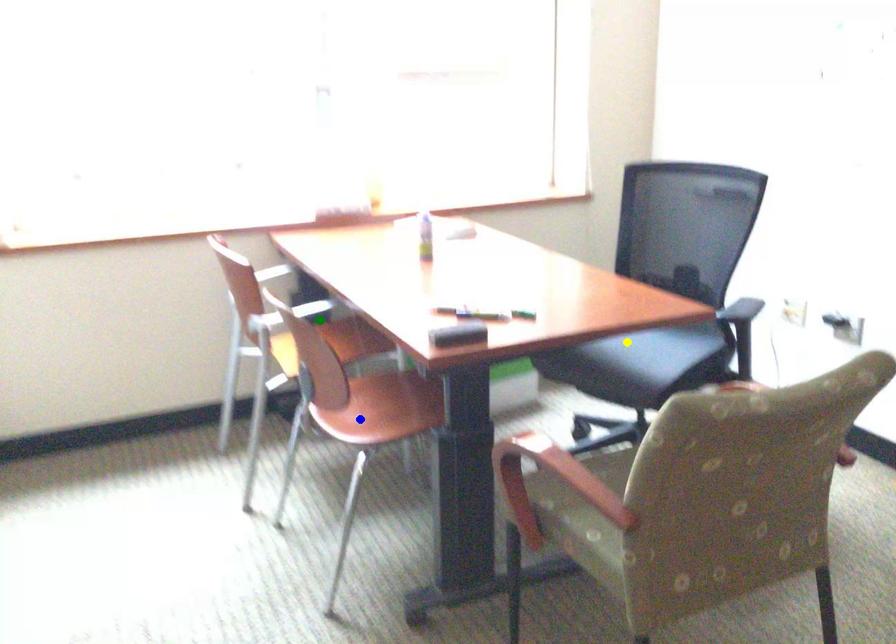
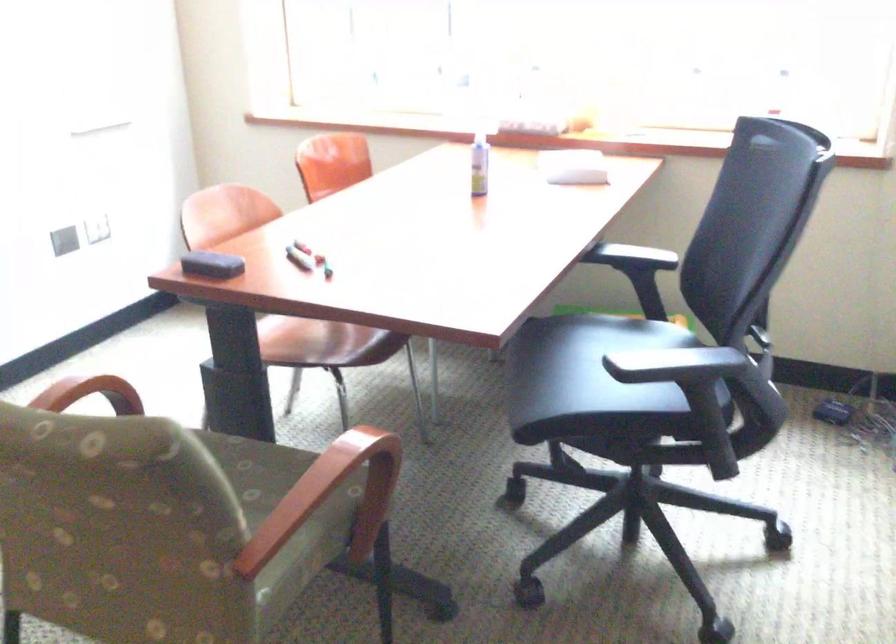
I am providing you with two images of the same scene from different viewpoints. Three points are marked in image1. Which point corresponds to a part or object that is occluded in image2?In image1, three points are marked. Which of them correspond to a part or object that is occluded in image2?Among the three points shown in image1, which one corresponds to a part or object that is no longer visible due to occlusion in image2?

green point cannot be seen in image2.